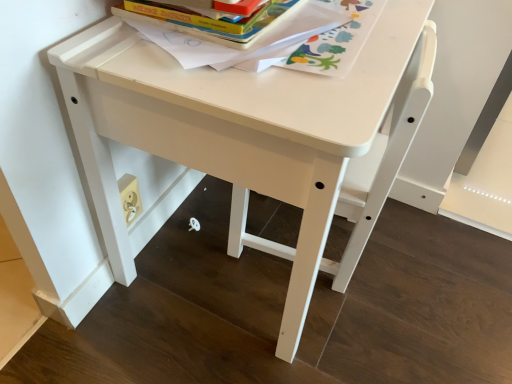
You are a GUI agent. You are given a task and a screenshot of the screen. Output one action in this format:
    pyautogui.click(x=<x>, y=<y>)
    Task: Click on the vacant region under white matte table at center (from a real-world perspective)
    
    Given the screenshot: What is the action you would take?
    pyautogui.click(x=211, y=251)